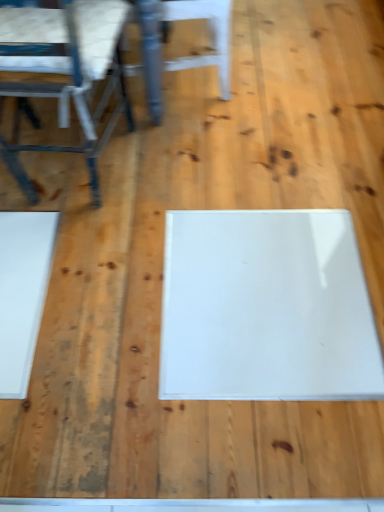
Question: Which direction should I rotate to look at white glossy chair at upper center, which appears as the second chair when viewed from the left?

Choices:
 (A) right
 (B) left

Answer: (B)

Question: Is metallic blue chair at left, which is the second chair in right-to-left order, thinner than white glossy chair at upper center, which appears as the second chair when viewed from the left?

Choices:
 (A) yes
 (B) no

Answer: (B)

Question: Does metallic blue chair at left, acting as the first chair starting from the left, have a larger size compared to white glossy chair at upper center, which appears as the second chair when viewed from the left?

Choices:
 (A) yes
 (B) no

Answer: (A)

Question: Is metallic blue chair at left, acting as the first chair starting from the left, to the right of white glossy chair at upper center, which appears as the second chair when viewed from the left, from the viewer's perspective?

Choices:
 (A) yes
 (B) no

Answer: (B)

Question: Is metallic blue chair at left, which is the second chair in right-to-left order, oriented towards white glossy chair at upper center, which appears as the second chair when viewed from the left?

Choices:
 (A) yes
 (B) no

Answer: (B)

Question: Does metallic blue chair at left, acting as the first chair starting from the left, lie in front of white glossy chair at upper center, which appears as the 1th chair when viewed from the right?

Choices:
 (A) yes
 (B) no

Answer: (A)

Question: Is metallic blue chair at left, acting as the first chair starting from the left, at the left side of white glossy chair at upper center, which appears as the 1th chair when viewed from the right?

Choices:
 (A) no
 (B) yes

Answer: (B)

Question: Can you confirm if white glossy chair at upper center, which appears as the 1th chair when viewed from the right, is thinner than metallic blue chair at left, acting as the first chair starting from the left?

Choices:
 (A) yes
 (B) no

Answer: (A)

Question: From a real-world perspective, is white glossy chair at upper center, which appears as the 1th chair when viewed from the right, located higher than metallic blue chair at left, which is the second chair in right-to-left order?

Choices:
 (A) yes
 (B) no

Answer: (B)

Question: From the image's perspective, is white glossy chair at upper center, which appears as the second chair when viewed from the left, located beneath metallic blue chair at left, acting as the first chair starting from the left?

Choices:
 (A) no
 (B) yes

Answer: (A)

Question: Can you confirm if white glossy chair at upper center, which appears as the 1th chair when viewed from the right, is taller than metallic blue chair at left, acting as the first chair starting from the left?

Choices:
 (A) no
 (B) yes

Answer: (A)

Question: Considering the relative sizes of white glossy chair at upper center, which appears as the 1th chair when viewed from the right, and metallic blue chair at left, which is the second chair in right-to-left order, in the image provided, is white glossy chair at upper center, which appears as the 1th chair when viewed from the right, bigger than metallic blue chair at left, which is the second chair in right-to-left order,?

Choices:
 (A) yes
 (B) no

Answer: (B)

Question: Considering the relative sizes of white glossy chair at upper center, which appears as the 1th chair when viewed from the right, and metallic blue chair at left, acting as the first chair starting from the left, in the image provided, is white glossy chair at upper center, which appears as the 1th chair when viewed from the right, smaller than metallic blue chair at left, acting as the first chair starting from the left,?

Choices:
 (A) no
 (B) yes

Answer: (B)

Question: In terms of height, does white glossy chair at upper center, which appears as the second chair when viewed from the left, look taller or shorter compared to metallic blue chair at left, acting as the first chair starting from the left?

Choices:
 (A) tall
 (B) short

Answer: (B)